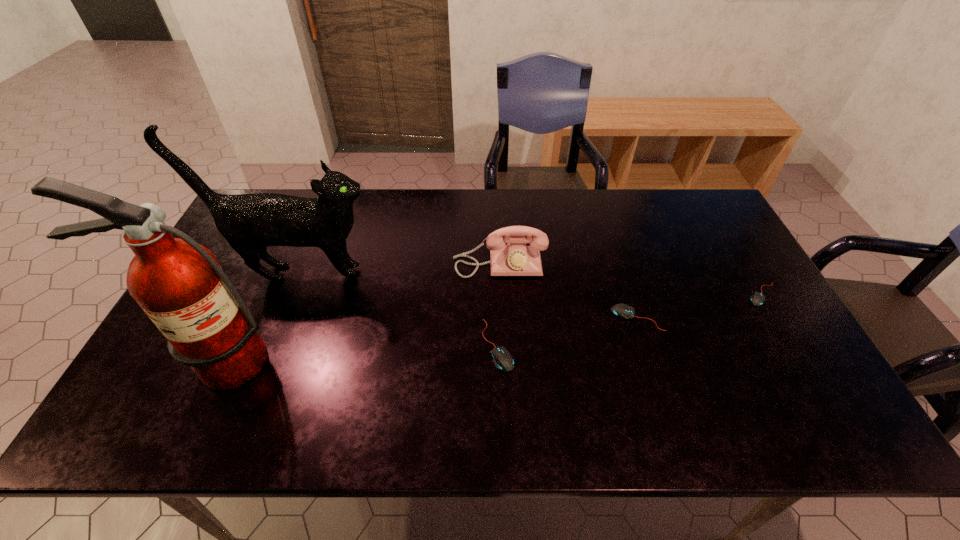
At what (x,y) coordinates should I click in order to perform the action: click on free space that satisfies the following two spatial constraints: 1. on the dial of the telephone; 2. on the face of the cat. Please return your answer as a coordinate pair (x, y). The image size is (960, 540). Looking at the image, I should click on (500, 273).

Where is `vacant area that satisfies the following two spatial constraints: 1. on the dial of the third tallest object; 2. on the left side of the second shortest object`? vacant area that satisfies the following two spatial constraints: 1. on the dial of the third tallest object; 2. on the left side of the second shortest object is located at coordinates (502, 318).

Where is `free space that satisfies the following two spatial constraints: 1. on the back side of the leftmost mouse; 2. on the left side of the fifth tallest object`? The height and width of the screenshot is (540, 960). free space that satisfies the following two spatial constraints: 1. on the back side of the leftmost mouse; 2. on the left side of the fifth tallest object is located at coordinates (497, 318).

What are the coordinates of `blank area in the image that satisfies the following two spatial constraints: 1. on the face of the leftmost mouse; 2. on the left side of the cat` in the screenshot? It's located at (273, 345).

I want to click on vacant region that satisfies the following two spatial constraints: 1. on the face of the cat; 2. on the right side of the fifth tallest object, so click(283, 318).